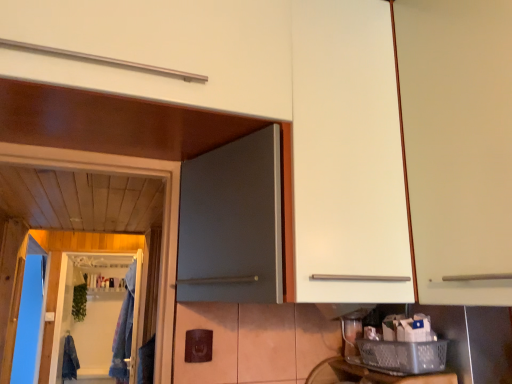
Question: From the image's perspective, would you say white matte cabinet at right is shown under blue fabric laundry at left, acting as the 2th laundry starting from the left?

Choices:
 (A) no
 (B) yes

Answer: (A)

Question: Can you confirm if white matte cabinet at right is bigger than blue fabric laundry at left, acting as the 2th laundry starting from the left?

Choices:
 (A) yes
 (B) no

Answer: (A)

Question: Does white matte cabinet at right have a greater width compared to blue fabric laundry at left, acting as the 2th laundry starting from the left?

Choices:
 (A) no
 (B) yes

Answer: (A)

Question: Is white matte cabinet at right positioned beyond the bounds of blue fabric laundry at left, arranged as the 2th laundry when ordered from the bottom?

Choices:
 (A) yes
 (B) no

Answer: (A)

Question: Is white matte cabinet at right oriented towards blue fabric laundry at left, arranged as the 2th laundry when ordered from the bottom?

Choices:
 (A) yes
 (B) no

Answer: (B)

Question: Is clear plastic screen door at lower left inside or outside of metallic silver basket at lower right?

Choices:
 (A) outside
 (B) inside

Answer: (A)

Question: Relative to metallic silver basket at lower right, is clear plastic screen door at lower left in front or behind?

Choices:
 (A) behind
 (B) front

Answer: (A)

Question: From a real-world perspective, relative to metallic silver basket at lower right, is clear plastic screen door at lower left vertically above or below?

Choices:
 (A) below
 (B) above

Answer: (B)

Question: Is point (125, 256) positioned closer to the camera than point (421, 382)?

Choices:
 (A) farther
 (B) closer

Answer: (A)

Question: From the image's perspective, is denim jacket at lower left, positioned as the 2th laundry in right-to-left order, located above or below white matte cabinet at right?

Choices:
 (A) above
 (B) below

Answer: (B)

Question: From a real-world perspective, relative to white matte cabinet at right, is denim jacket at lower left, which is counted as the second laundry, starting from the front, vertically above or below?

Choices:
 (A) above
 (B) below

Answer: (B)

Question: Considering the relative positions of denim jacket at lower left, positioned as the 2th laundry in right-to-left order, and white matte cabinet at right in the image provided, is denim jacket at lower left, positioned as the 2th laundry in right-to-left order, to the left or to the right of white matte cabinet at right?

Choices:
 (A) left
 (B) right

Answer: (A)

Question: Is denim jacket at lower left, positioned as the 2th laundry in right-to-left order, inside the boundaries of white matte cabinet at right, or outside?

Choices:
 (A) inside
 (B) outside

Answer: (B)

Question: Relative to metallic silver basket at lower right, is denim jacket at lower left, which ranks as the first laundry in left-to-right order, in front or behind?

Choices:
 (A) behind
 (B) front

Answer: (A)

Question: From the image's perspective, relative to metallic silver basket at lower right, is denim jacket at lower left, which ranks as the first laundry in left-to-right order, above or below?

Choices:
 (A) above
 (B) below

Answer: (B)